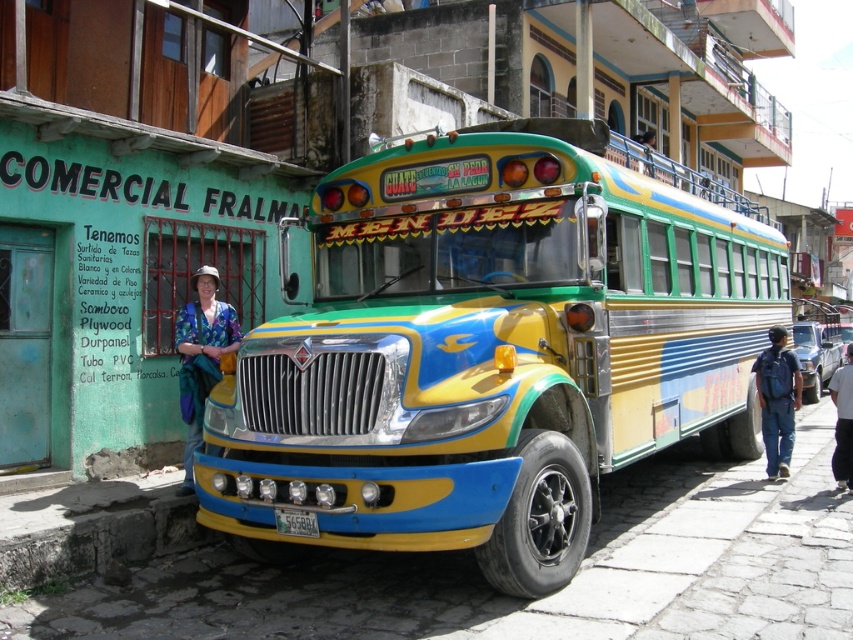
Does blue printed shirt at center have a lesser width compared to blue jeans at lower right?

No.

Which is in front, point (194, 369) or point (776, 458)?

Point (194, 369) is more forward.

You are a GUI agent. You are given a task and a screenshot of the screen. Output one action in this format:
    pyautogui.click(x=<x>, y=<y>)
    Task: Click on the blue printed shirt at center
    Image resolution: width=853 pixels, height=640 pixels.
    Given the screenshot: What is the action you would take?
    pyautogui.click(x=201, y=355)

Which is above, concrete at lower left or black fabric pants at lower right?

black fabric pants at lower right is higher up.

Identify the location of concrete at lower left. (100, 538).

Is point (70, 528) in front of point (845, 470)?

Yes, it is in front of point (845, 470).

At what (x,y) coordinates should I click in order to perform the action: click on concrete at lower left. Please return your answer as a coordinate pair (x, y). This screenshot has width=853, height=640. Looking at the image, I should click on (100, 538).

From the picture: Between shiny metallic bus at center and black fabric pants at lower right, which one is positioned higher?

shiny metallic bus at center is above.

From the picture: Can you confirm if shiny metallic bus at center is smaller than black fabric pants at lower right?

Yes, shiny metallic bus at center is smaller than black fabric pants at lower right.

Who is more distant from viewer, (746,326) or (842,477)?

The point (746,326) is behind.

The image size is (853, 640). Identify the location of shiny metallic bus at center. (488, 353).